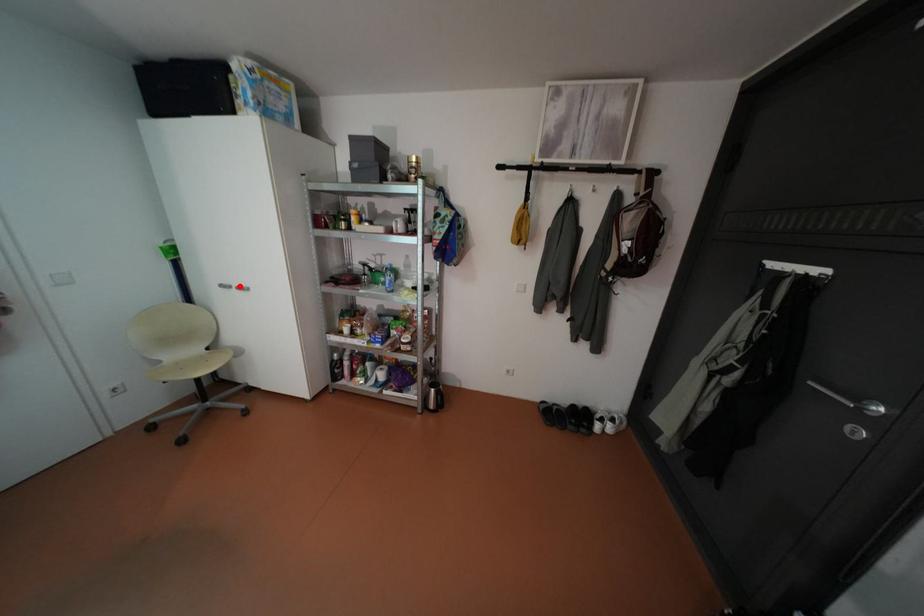
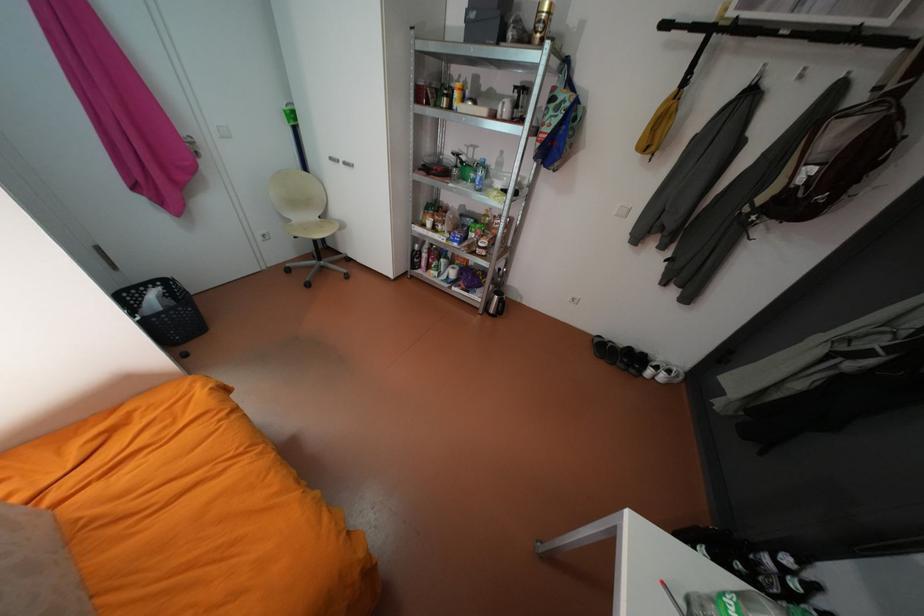
Where in the second image is the point corresponding to the highlighted location from the first image?

(347, 160)